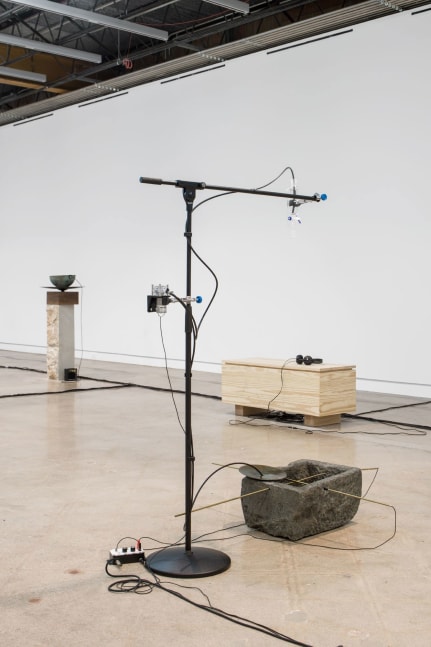
This screenshot has height=647, width=431. In order to click on cables in this screenshot , I will do `click(158, 541)`, `click(134, 538)`, `click(135, 583)`, `click(124, 587)`, `click(191, 587)`, `click(330, 547)`, `click(282, 382)`, `click(162, 336)`, `click(206, 264)`, `click(81, 313)`.